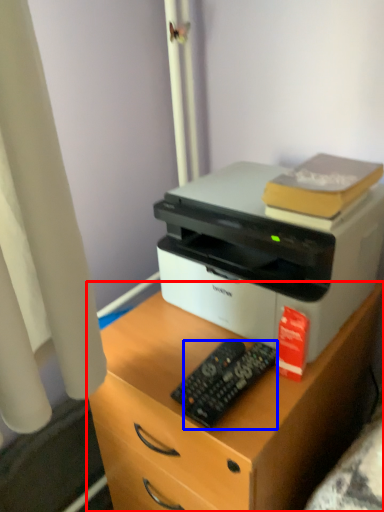
Question: Which object is closer to the camera taking this photo, desk (highlighted by a red box) or control (highlighted by a blue box)?

Choices:
 (A) desk
 (B) control

Answer: (A)